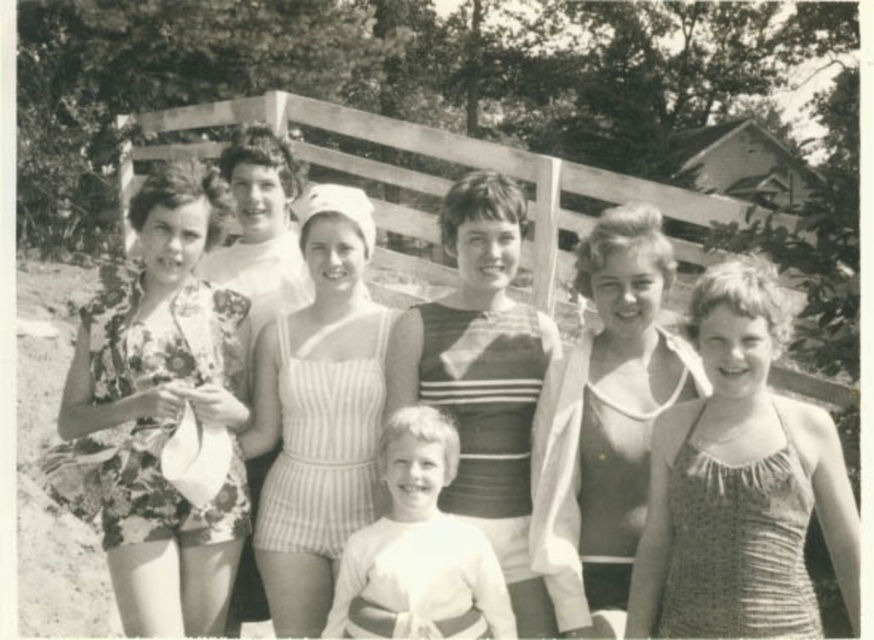
Question: Considering the real-world distances, which object is closest to the striped knit sweater at center?

Choices:
 (A) polka dot fabric swimsuit at center
 (B) striped fabric swimsuit at center
 (C) white cotton shirt at center

Answer: (C)

Question: Considering the real-world distances, which object is farthest from the wooden fence at center?

Choices:
 (A) striped fabric swimsuit at center
 (B) striped knit sweater at center
 (C) polka dot fabric swimsuit at center
 (D) white cotton shirt at center

Answer: (B)

Question: Is striped knit sweater at center smaller than white cotton shirt at center?

Choices:
 (A) yes
 (B) no

Answer: (B)

Question: Does floral fabric dress at left have a larger size compared to white striped swimsuit at center?

Choices:
 (A) yes
 (B) no

Answer: (B)

Question: Is polka dot fabric swimsuit at center above white cotton shirt at center?

Choices:
 (A) no
 (B) yes

Answer: (B)

Question: Which of the following is the farthest from the observer?

Choices:
 (A) white striped swimsuit at center
 (B) white cotton shirt at center
 (C) floral fabric dress at left
 (D) striped knit sweater at center

Answer: (A)